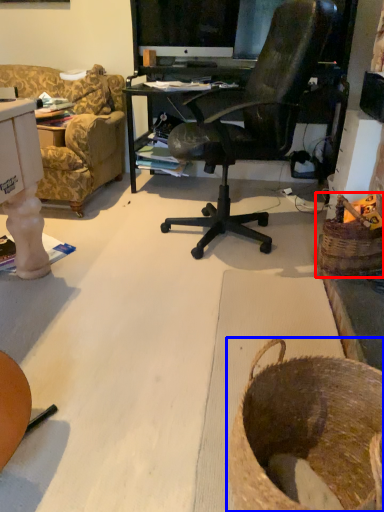
Question: Which object is further to the camera taking this photo, basket (highlighted by a red box) or basket (highlighted by a blue box)?

Choices:
 (A) basket
 (B) basket

Answer: (A)